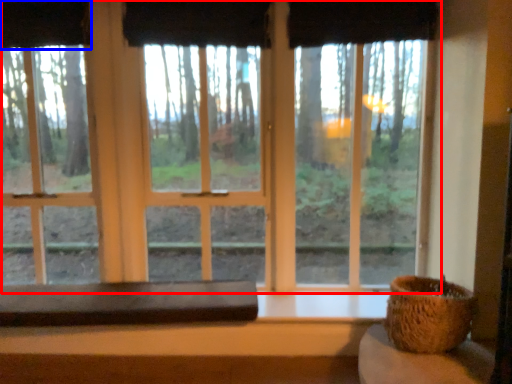
Question: Which of the following is the farthest to the observer, window (highlighted by a red box) or curtain (highlighted by a blue box)?

Choices:
 (A) window
 (B) curtain

Answer: (B)